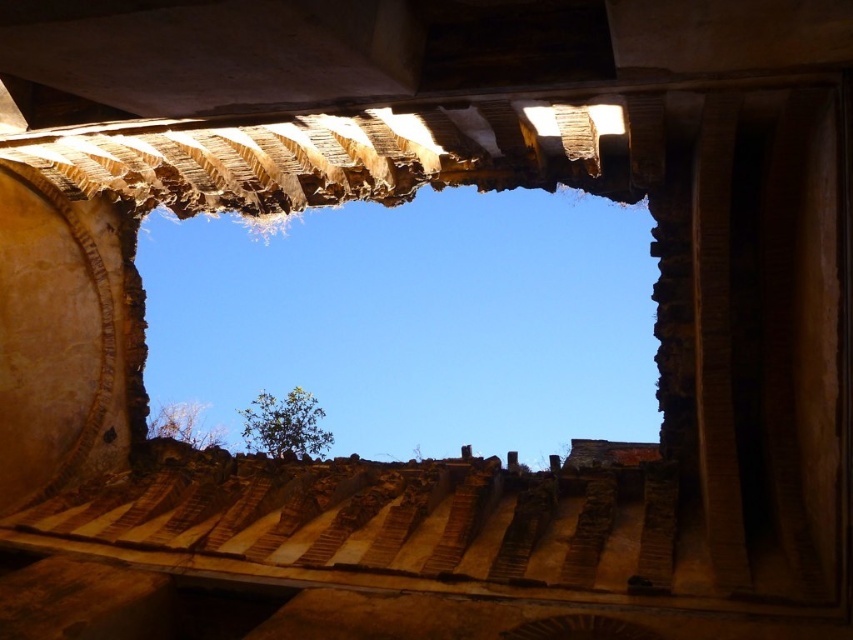
You are inside the partially collapsed structure and want to look out through the rusty stone window at center. Based on your current position, is the window directly above or below you?

The rusty stone window at center is located at point coordinates, but without specific positional data, we can infer from the scene description that you are looking upwards through the structure. Since the window is at the center, it is likely positioned above your head, so the window is above you.